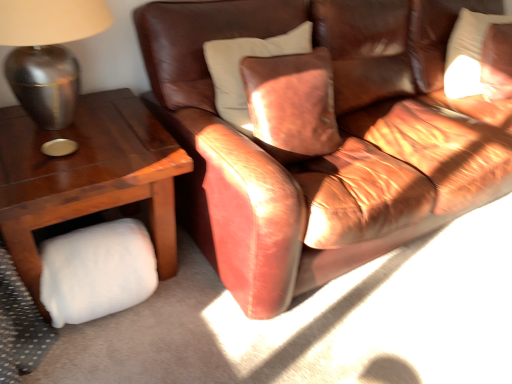
Question: Considering the positions of point [x=151, y=271] and point [x=74, y=11], is point [x=151, y=271] closer or farther from the camera than point [x=74, y=11]?

Choices:
 (A) closer
 (B) farther

Answer: (B)

Question: In the image, is white fluffy pillow at lower left on the left side or the right side of metallic silver lamp at left?

Choices:
 (A) left
 (B) right

Answer: (B)

Question: Based on their relative distances, which object is farther from the white soft pillow at upper right?

Choices:
 (A) metallic silver lamp at left
 (B) woodenobject at left
 (C) leather couch at center
 (D) white fluffy pillow at lower left

Answer: (D)

Question: Estimate the real-world distances between objects in this image. Which object is farther from the white fluffy pillow at lower left?

Choices:
 (A) metallic silver lamp at left
 (B) woodenobject at left
 (C) white soft pillow at upper right
 (D) leather couch at center

Answer: (C)